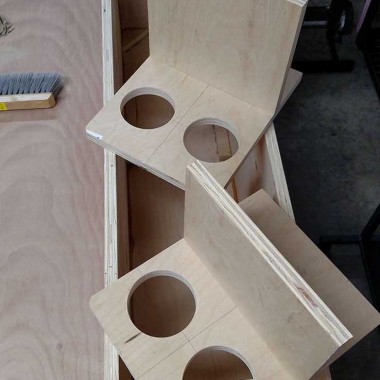
I want to click on bottom cup holder, so click(249, 317).